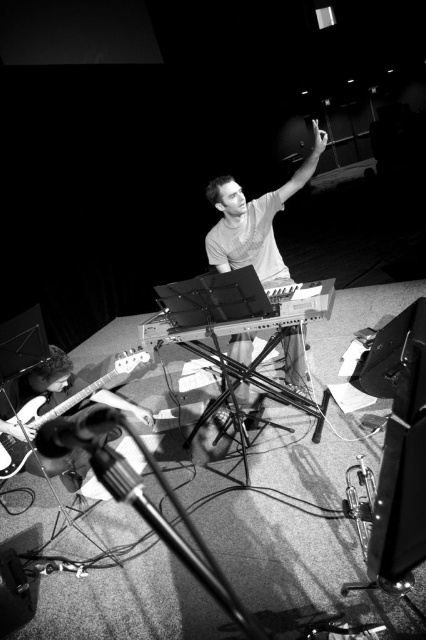
Between metallic electric guitar at lower left and metallic silver microphone at lower left, which one is positioned lower?

metallic silver microphone at lower left

Is metallic electric guitar at lower left positioned at the back of metallic silver microphone at lower left?

No, metallic electric guitar at lower left is in front of metallic silver microphone at lower left.

Does point (46, 394) come behind point (57, 429)?

Yes, point (46, 394) is farther from viewer.

Where is `metallic electric guitar at lower left`? metallic electric guitar at lower left is located at coordinates (60, 403).

Does point (284, 355) come behind point (86, 440)?

Yes, it is.

Which of these two, matte gray shirt at center or metallic silver microphone at lower left, stands shorter?

Standing shorter between the two is metallic silver microphone at lower left.

Locate an element on the screen. matte gray shirt at center is located at coordinates click(255, 221).

Can you confirm if matte gray shirt at center is thinner than metallic electric guitar at lower left?

Yes.

Is matte gray shirt at center behind metallic electric guitar at lower left?

Yes, matte gray shirt at center is behind metallic electric guitar at lower left.

Who is more forward, [299,362] or [58,403]?

Positioned in front is point [58,403].

Image resolution: width=426 pixels, height=640 pixels. I want to click on matte gray shirt at center, so click(x=255, y=221).